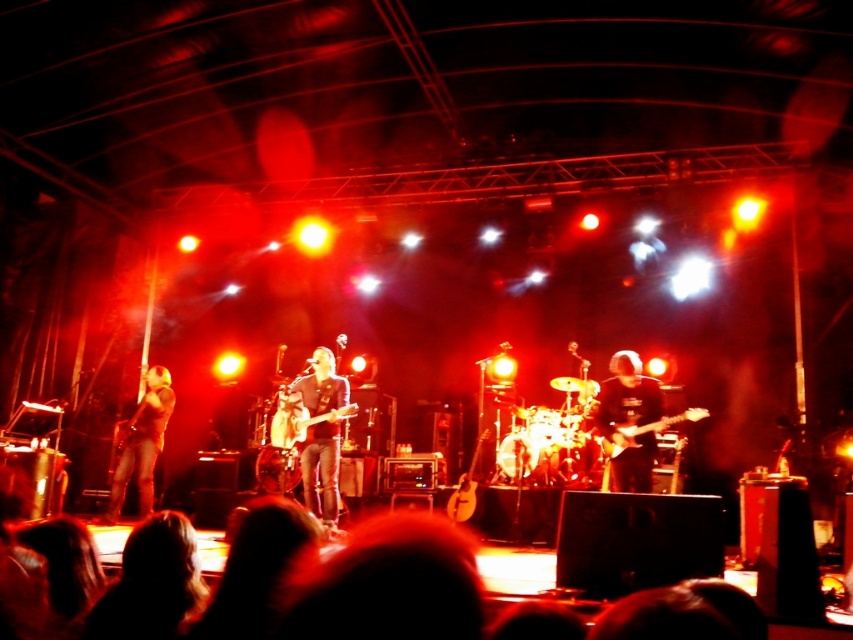
You are a stagehand standing at the back of the stage. You need to retrieve two tools located at point A and point B. Point A is at coordinates point (x=643, y=452) and point B is at coordinates point (x=303, y=474). Which point should you go to first if you want to collect the tools in the shortest path possible?

You should go to point A at coordinates point (x=643, y=452) first because it is closer to you than point B at coordinates point (x=303, y=474), so the shortest path would be to go to the closer point first.

You are a photographer at the live music performance. You need to capture a clear shot of the dark blue shirt at center and the dark blue fabric shirt at center. Which one is positioned higher in the frame?

The dark blue shirt at center is positioned higher in the frame than the dark blue fabric shirt at center.